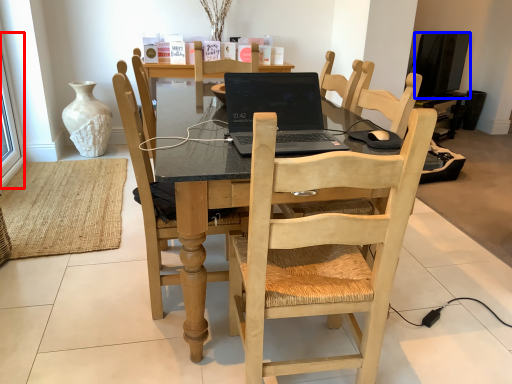
Question: Which point is further to the camera, window screen (highlighted by a red box) or television (highlighted by a blue box)?

Choices:
 (A) window screen
 (B) television

Answer: (B)